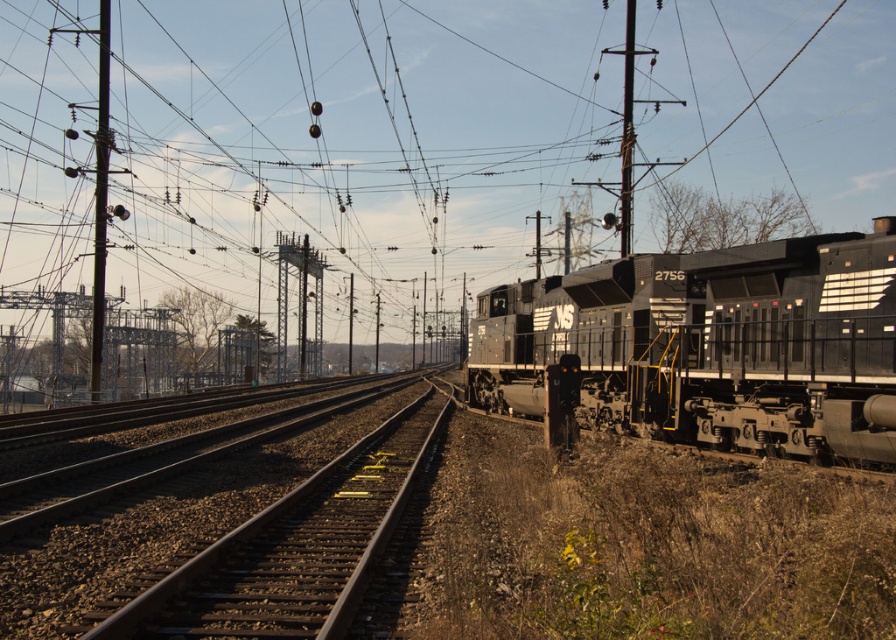
Does matte black locomotive at center appear on the left side of metallic gray pole at left?

Incorrect, matte black locomotive at center is not on the left side of metallic gray pole at left.

Does matte black locomotive at center have a smaller size compared to metallic gray pole at left?

Yes.

I want to click on matte black locomotive at center, so click(711, 344).

Who is more distant from viewer, (868, 426) or (626, 161)?

The point (626, 161) is behind.

Can you confirm if matte black locomotive at center is positioned below metallic pole at center?

Correct, matte black locomotive at center is located below metallic pole at center.

Image resolution: width=896 pixels, height=640 pixels. Identify the location of matte black locomotive at center. (711, 344).

Is matte black locomotive at center to the left of brown gravel track at center from the viewer's perspective?

In fact, matte black locomotive at center is to the right of brown gravel track at center.

Who is shorter, matte black locomotive at center or brown gravel track at center?

With less height is brown gravel track at center.

Image resolution: width=896 pixels, height=640 pixels. What do you see at coordinates (711, 344) in the screenshot?
I see `matte black locomotive at center` at bounding box center [711, 344].

The width and height of the screenshot is (896, 640). Find the location of `matte black locomotive at center`. matte black locomotive at center is located at coordinates (711, 344).